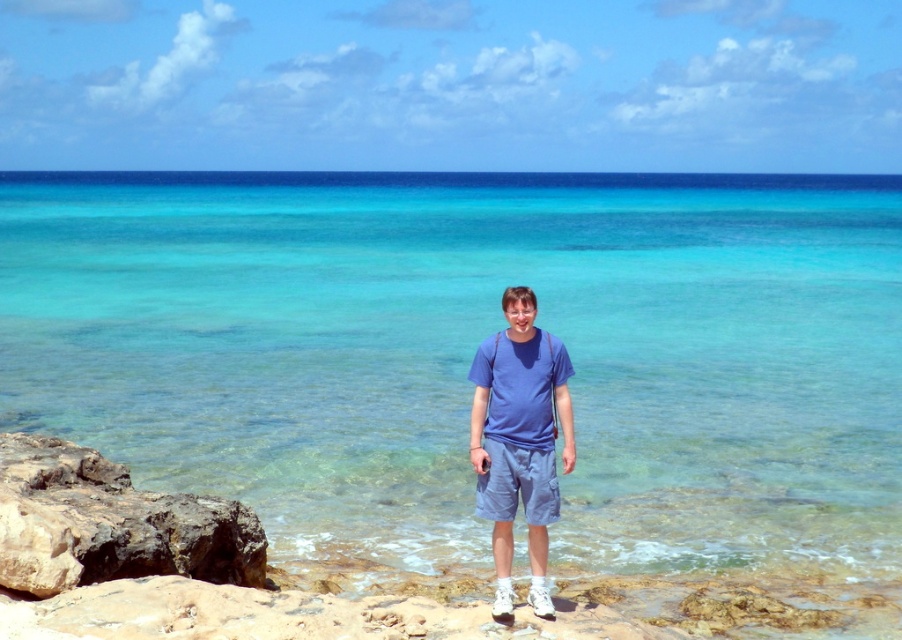
You are standing on the beach and want to pick up a seashell that is 5 meters away from you. Is the dark gray rock at lower left closer to you than the seashell?

The dark gray rock at lower left is 6.37 meters away from the viewer, which is farther than the seashell at 5 meters. Therefore, the seashell is closer to you than the dark gray rock at lower left.

You are a photographer trying to capture the blue cotton shirt at center and the clear blue water at center in a single shot. Based on the scene, can you determine which object is closer to the camera?

The clear blue water at center is closer to the camera than the blue cotton shirt at center because the blue cotton shirt at center is behind the clear blue water at center.